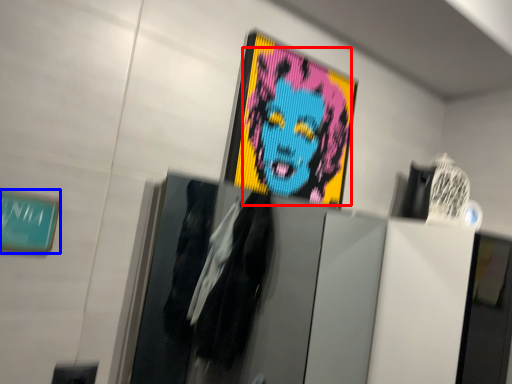
Question: Which object is further to the camera taking this photo, person (highlighted by a red box) or poster (highlighted by a blue box)?

Choices:
 (A) person
 (B) poster

Answer: (A)